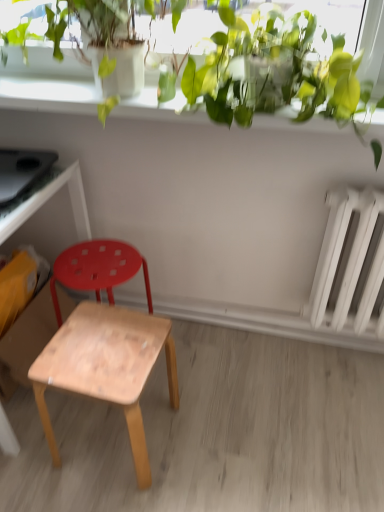
Where is `empty space that is ontop of wooden stool at lower left, marked as the 1th stool in a back-to-front arrangement (from a real-world perspective)`? The image size is (384, 512). empty space that is ontop of wooden stool at lower left, marked as the 1th stool in a back-to-front arrangement (from a real-world perspective) is located at coordinates pyautogui.click(x=94, y=263).